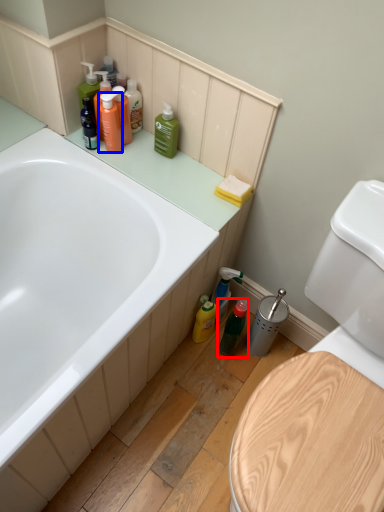
Question: Among these objects, which one is farthest to the camera, mouthwash (highlighted by a red box) or toiletry (highlighted by a blue box)?

Choices:
 (A) mouthwash
 (B) toiletry

Answer: (A)